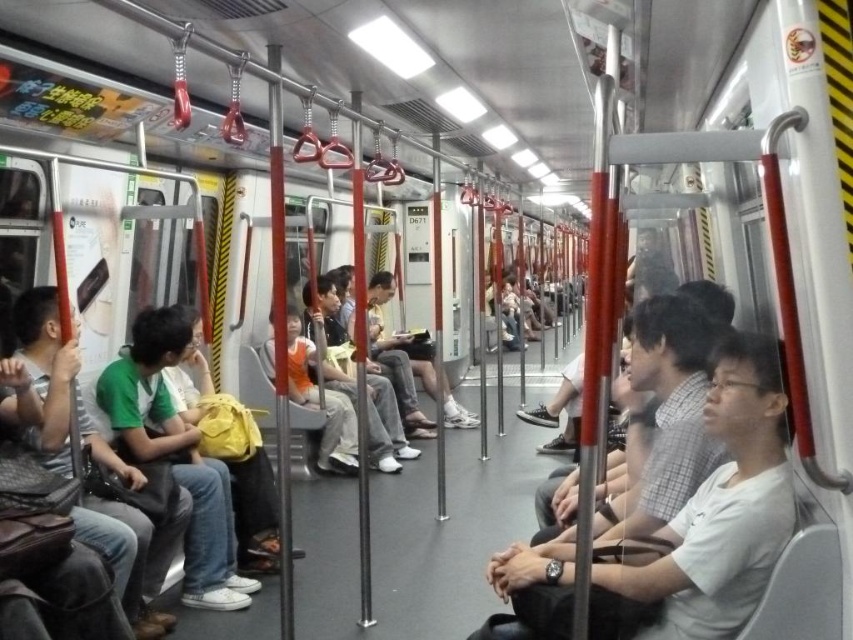
Question: Which object is positioned farthest from the yellow fabric backpack at center?

Choices:
 (A) green fabric backpack at left
 (B) white matte shirt at right

Answer: (B)

Question: Is white matte shirt at right smaller than yellow fabric backpack at center?

Choices:
 (A) no
 (B) yes

Answer: (A)

Question: Can you confirm if white matte shirt at right is wider than green fabric backpack at left?

Choices:
 (A) yes
 (B) no

Answer: (A)

Question: Observing the image, what is the correct spatial positioning of green fabric backpack at left in reference to yellow fabric backpack at center?

Choices:
 (A) above
 (B) below

Answer: (B)

Question: Which point is closer to the camera?

Choices:
 (A) yellow fabric backpack at center
 (B) white matte shirt at right

Answer: (B)

Question: Which object is the farthest from the white matte shirt at right?

Choices:
 (A) yellow fabric backpack at center
 (B) green fabric backpack at left

Answer: (A)